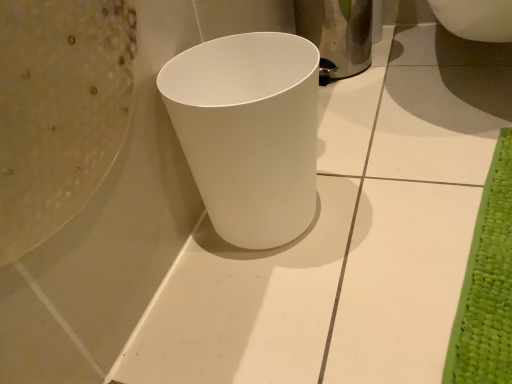
What is the approximate width of white matte trash can at center?

white matte trash can at center is 7.63 inches wide.

The height and width of the screenshot is (384, 512). I want to click on white matte trash can at center, so click(249, 132).

Describe the element at coordinates (249, 132) in the screenshot. I see `white matte trash can at center` at that location.

In order to face white matte trash can at center, should I rotate leftwards or rightwards?

You should rotate right by 0.132 degrees.

Locate an element on the screen. Image resolution: width=512 pixels, height=384 pixels. white matte trash can at center is located at coordinates (249, 132).